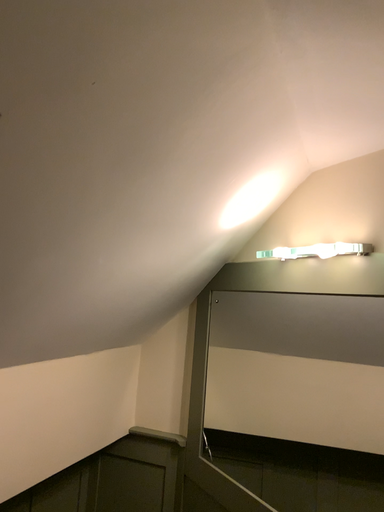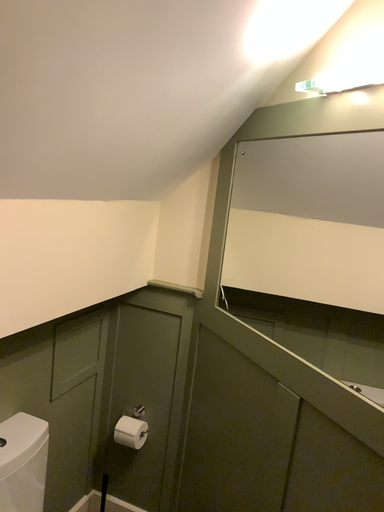
Question: How did the camera likely rotate when shooting the video?

Choices:
 (A) rotated upward
 (B) rotated downward

Answer: (B)